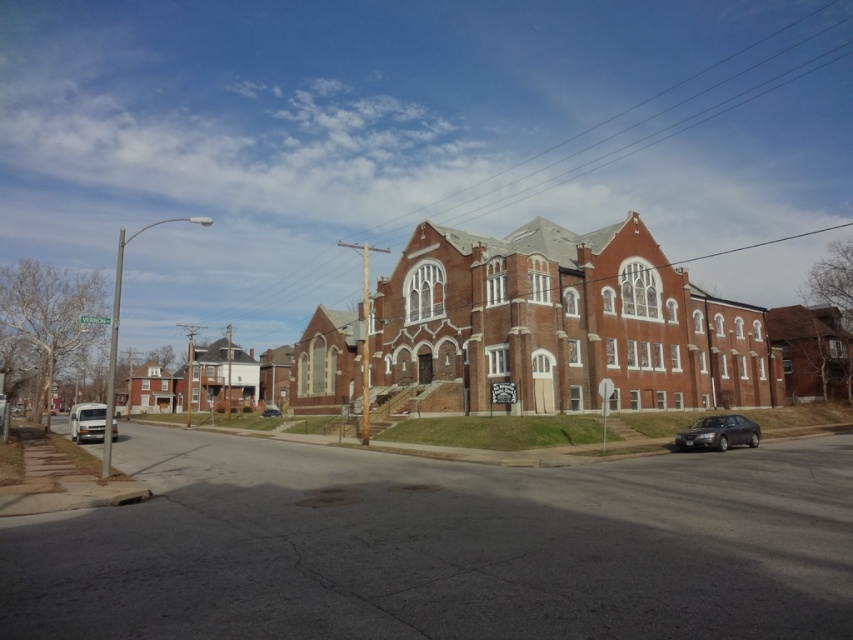
Question: Does shiny black sedan at lower right lie in front of white matte van at lower left?

Choices:
 (A) no
 (B) yes

Answer: (A)

Question: Based on their relative distances, which object is nearer to the metallic silver car at center?

Choices:
 (A) white matte van at lower left
 (B) shiny black sedan at lower right
 (C) brick church at center

Answer: (A)

Question: Can you confirm if brick church at center is positioned below shiny black sedan at lower right?

Choices:
 (A) no
 (B) yes

Answer: (A)

Question: Which point appears farthest from the camera in this image?

Choices:
 (A) (401, 285)
 (B) (274, 410)
 (C) (712, 442)

Answer: (B)

Question: Is shiny black sedan at lower right thinner than metallic silver car at center?

Choices:
 (A) no
 (B) yes

Answer: (B)

Question: Which object is positioned farthest from the metallic silver car at center?

Choices:
 (A) white matte van at lower left
 (B) brick church at center

Answer: (B)